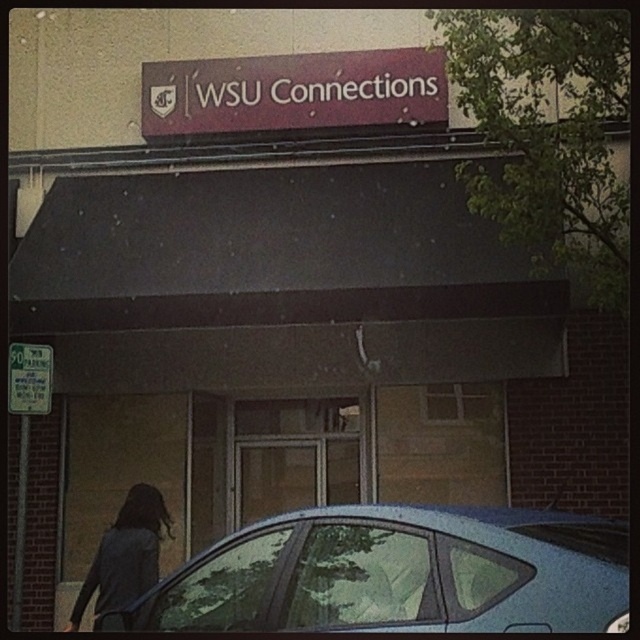
From the picture: Does matte maroon sign at upper center lie in front of dark gray sweater at lower left?

No, matte maroon sign at upper center is further to the viewer.

Measure the distance between point (320,54) and camera.

Point (320,54) and camera are 10.15 meters apart.

Does point (198, 131) come in front of point (113, 525)?

Yes, point (198, 131) is in front of point (113, 525).

Where is `matte maroon sign at upper center`? matte maroon sign at upper center is located at coordinates (x=292, y=92).

Between metallic silver car at lower center and matte maroon sign at upper center, which one is positioned lower?

metallic silver car at lower center is lower down.

This screenshot has width=640, height=640. What are the coordinates of `metallic silver car at lower center` in the screenshot? It's located at pos(400,573).

Image resolution: width=640 pixels, height=640 pixels. Identify the location of metallic silver car at lower center. (400, 573).

The image size is (640, 640). I want to click on dark gray sweater at lower left, so click(125, 556).

Is dark gray sweater at lower left to the right of green paper sign at left from the viewer's perspective?

Indeed, dark gray sweater at lower left is positioned on the right side of green paper sign at left.

You are a GUI agent. You are given a task and a screenshot of the screen. Output one action in this format:
    pyautogui.click(x=<x>, y=<y>)
    Task: Click on the dark gray sweater at lower left
    The width and height of the screenshot is (640, 640).
    Given the screenshot: What is the action you would take?
    pyautogui.click(x=125, y=556)